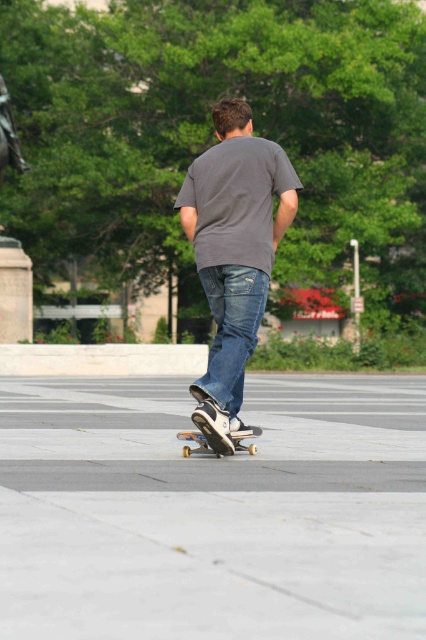
Is denim jeans at center further to camera compared to wooden skateboard at center?

No, it is not.

From the picture: Between denim jeans at center and wooden skateboard at center, which one has more height?

With more height is denim jeans at center.

Who is more distant from viewer, (x=224, y=385) or (x=244, y=428)?

The point (x=244, y=428) is more distant.

The image size is (426, 640). Identify the location of denim jeans at center. (230, 332).

Can you confirm if matte gray t-shirt at center is taller than wooden skateboard at center?

Correct, matte gray t-shirt at center is much taller as wooden skateboard at center.

Is matte gray t-shirt at center bigger than wooden skateboard at center?

Yes.

Identify the location of matte gray t-shirt at center. (233, 253).

The height and width of the screenshot is (640, 426). Find the location of `matte gray t-shirt at center`. matte gray t-shirt at center is located at coordinates (233, 253).

Who is shorter, smooth concrete skateboard at center or denim jeans at center?

smooth concrete skateboard at center

Can you confirm if smooth concrete skateboard at center is bigger than denim jeans at center?

Correct, smooth concrete skateboard at center is larger in size than denim jeans at center.

What do you see at coordinates (213, 512) in the screenshot?
I see `smooth concrete skateboard at center` at bounding box center [213, 512].

The height and width of the screenshot is (640, 426). I want to click on smooth concrete skateboard at center, so click(213, 512).